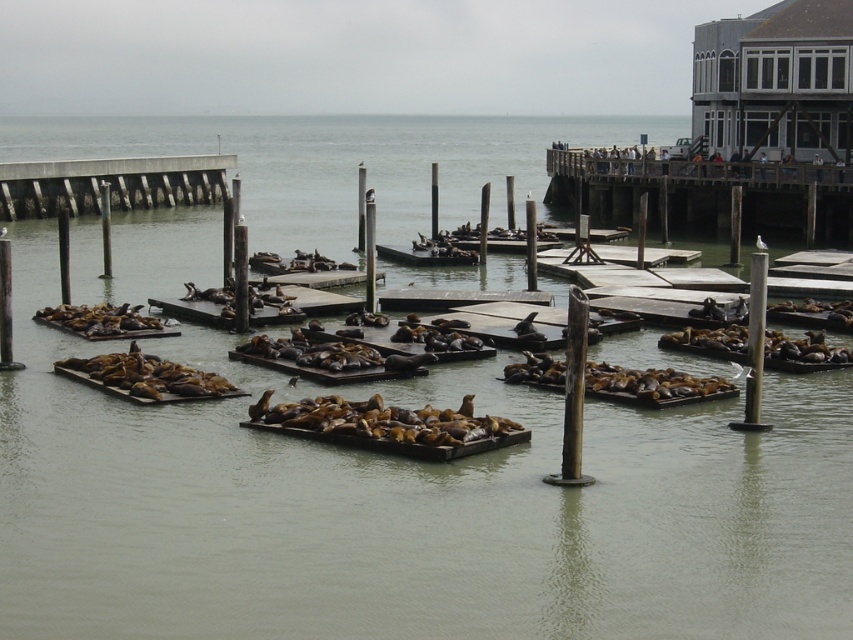
Which is more to the left, wooden dock at upper right or wooden planks at left?

Positioned to the left is wooden planks at left.

How distant is wooden dock at upper right from wooden planks at left?

wooden dock at upper right and wooden planks at left are 18.47 meters apart from each other.

You are a GUI agent. You are given a task and a screenshot of the screen. Output one action in this format:
    pyautogui.click(x=<x>, y=<y>)
    Task: Click on the wooden dock at upper right
    Image resolution: width=853 pixels, height=640 pixels.
    Given the screenshot: What is the action you would take?
    pyautogui.click(x=703, y=193)